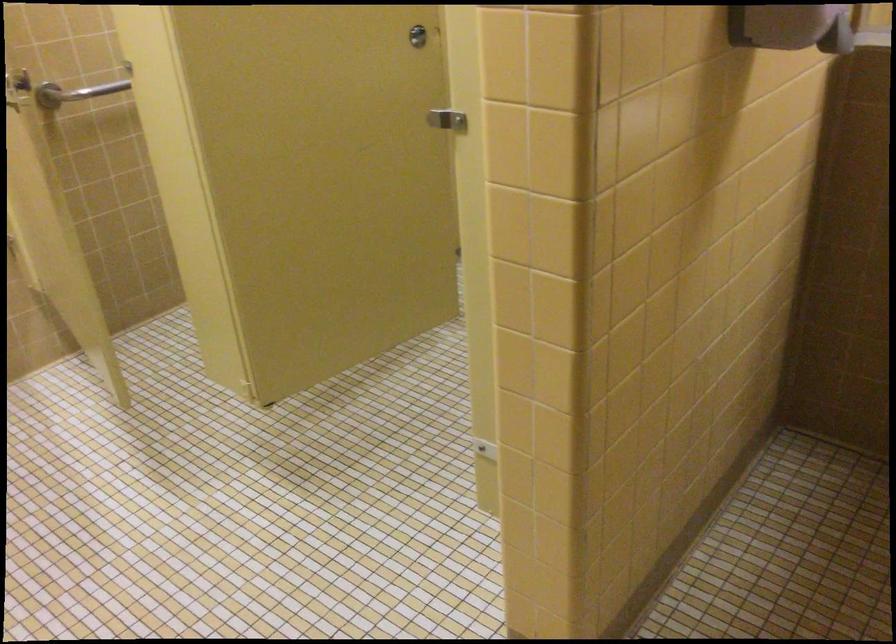
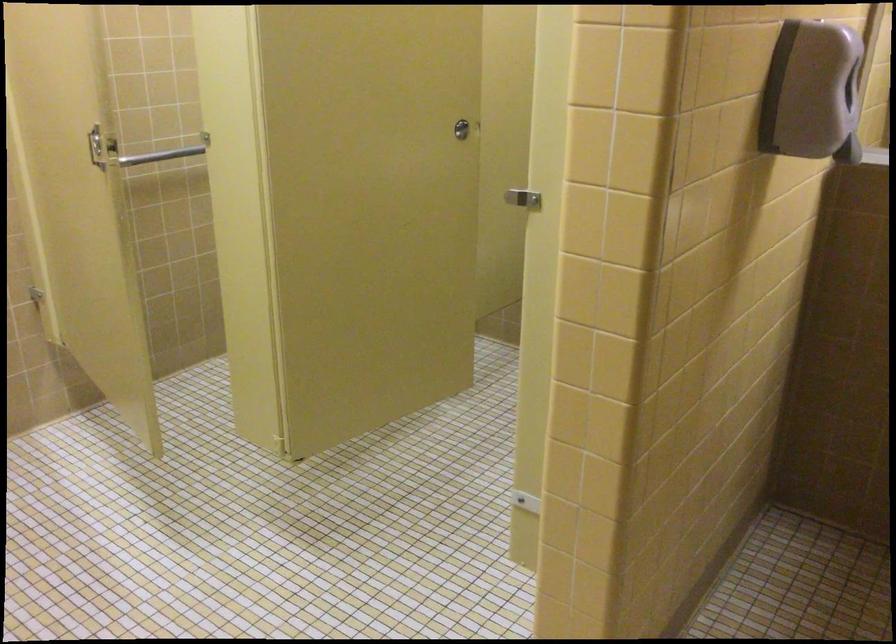
Looking at this image, in a continuous first-person perspective shot, in which direction is the camera moving?

The cameraman moved toward left, backward.